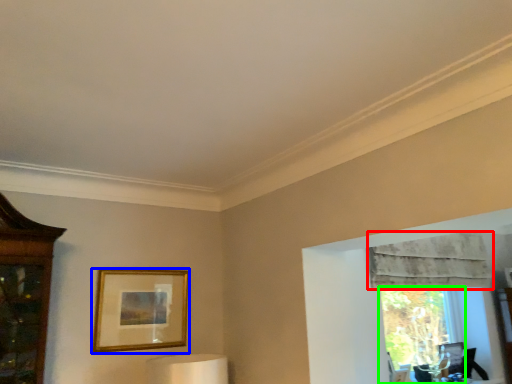
Question: Which object is the closest to the curtain (highlighted by a red box)? Choose among these: picture frame (highlighted by a blue box) or window (highlighted by a green box).

Choices:
 (A) picture frame
 (B) window

Answer: (B)